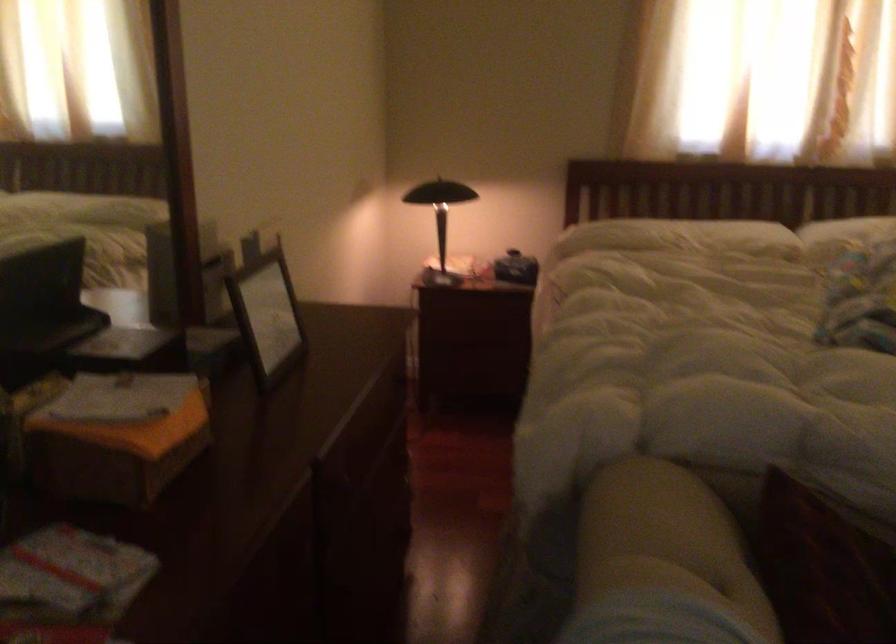
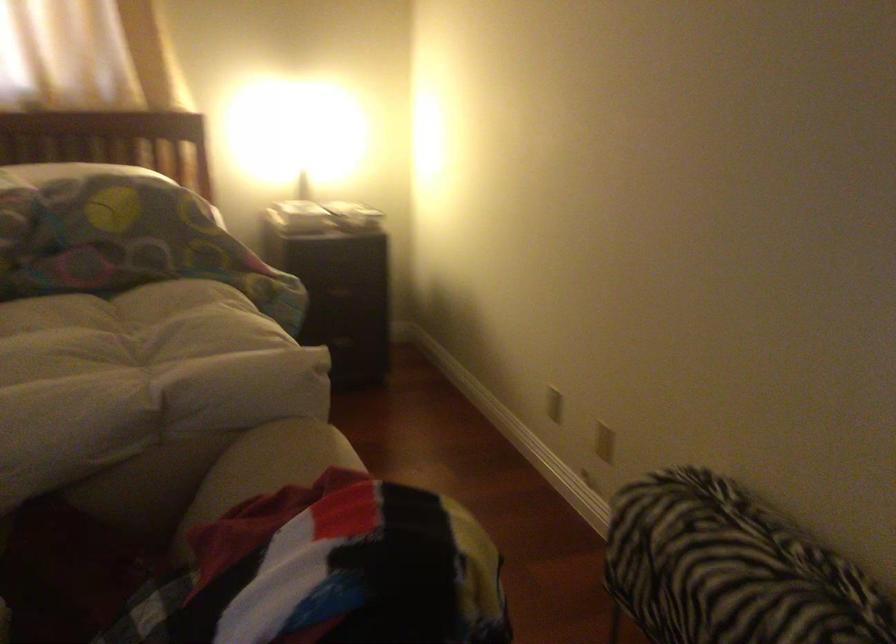
Question: The images are taken continuously from a first-person perspective. In which direction are you moving?

Choices:
 (A) Left
 (B) Right
 (C) Forward
 (D) Backward

Answer: (B)